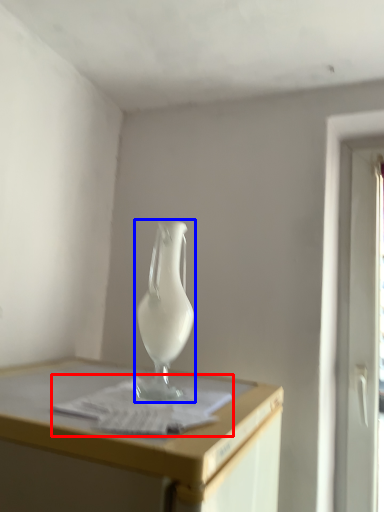
Question: Which object appears farthest to the camera in this image, paper (highlighted by a red box) or vase (highlighted by a blue box)?

Choices:
 (A) paper
 (B) vase

Answer: (B)